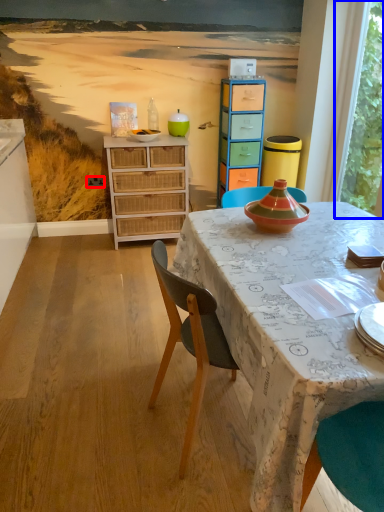
Question: Which object is further to the camera taking this photo, power outlet (highlighted by a red box) or window screen (highlighted by a blue box)?

Choices:
 (A) power outlet
 (B) window screen

Answer: (A)